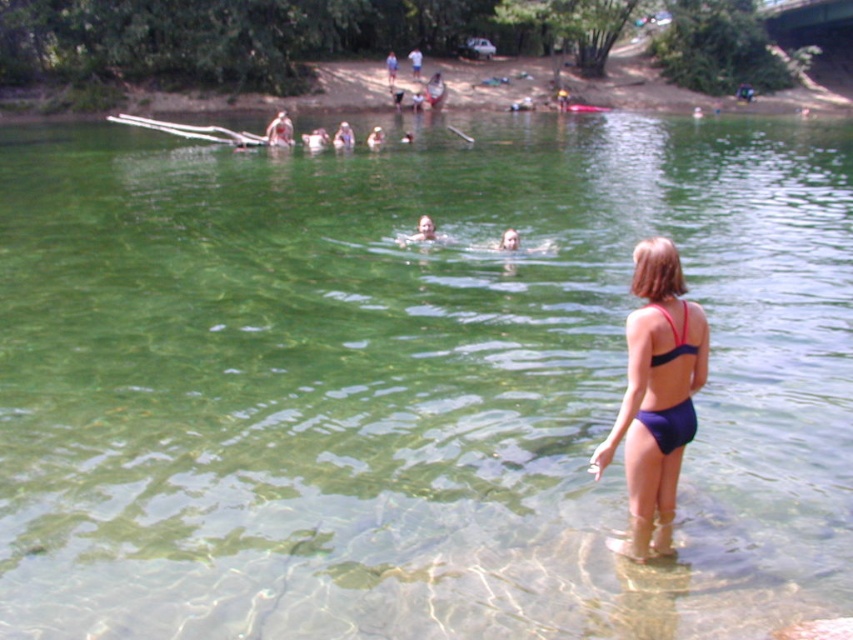
Question: Is purple fabric bikini at right above purple matte bikini at lower right?

Choices:
 (A) no
 (B) yes

Answer: (B)

Question: Can you confirm if purple fabric bikini at right is wider than purple matte bikini at lower right?

Choices:
 (A) yes
 (B) no

Answer: (A)

Question: Is purple fabric bikini at right to the left of purple matte bikini at lower right from the viewer's perspective?

Choices:
 (A) no
 (B) yes

Answer: (B)

Question: Among these points, which one is nearest to the camera?

Choices:
 (A) (662, 358)
 (B) (647, 541)

Answer: (A)

Question: Which of the following is the closest to the observer?

Choices:
 (A) purple fabric bikini at right
 (B) purple matte bikini at lower right

Answer: (A)